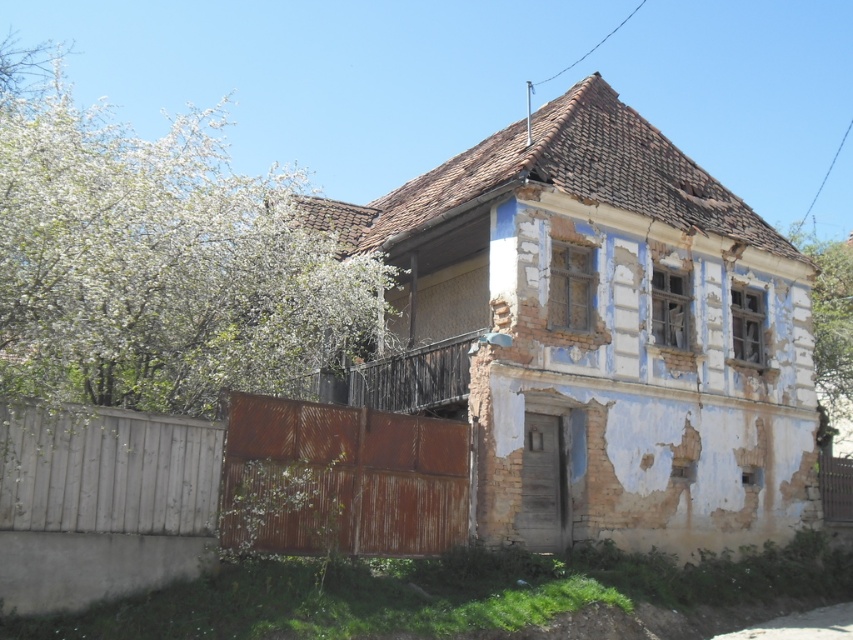
Question: Is white textured wall at upper right thinner than rusty metal gate at lower right?

Choices:
 (A) no
 (B) yes

Answer: (A)

Question: Based on their relative distances, which object is farther from the white blossoms at upper left?

Choices:
 (A) white wooden fence at lower left
 (B) white textured wall at upper right
 (C) rusty metal gate at lower right

Answer: (B)

Question: Estimate the real-world distances between objects in this image. Which object is farther from the rusty metal gate at lower right?

Choices:
 (A) white textured wall at upper right
 (B) white wooden fence at lower left
 (C) rusty corrugated metal fence at lower left

Answer: (B)

Question: Is rusty corrugated metal fence at lower left above white wooden fence at lower left?

Choices:
 (A) no
 (B) yes

Answer: (A)

Question: Is rusty corrugated metal fence at lower left below rusty metal gate at lower right?

Choices:
 (A) no
 (B) yes

Answer: (A)

Question: Which of the following is the farthest from the observer?

Choices:
 (A) (839, 472)
 (B) (439, 452)
 (C) (26, 433)

Answer: (A)